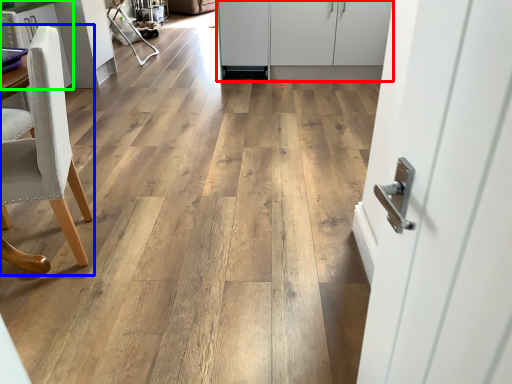
Question: Which object is the farthest from cabinetry (highlighted by a red box)? Choose among these: chair (highlighted by a blue box) or cabinetry (highlighted by a green box).

Choices:
 (A) chair
 (B) cabinetry

Answer: (A)